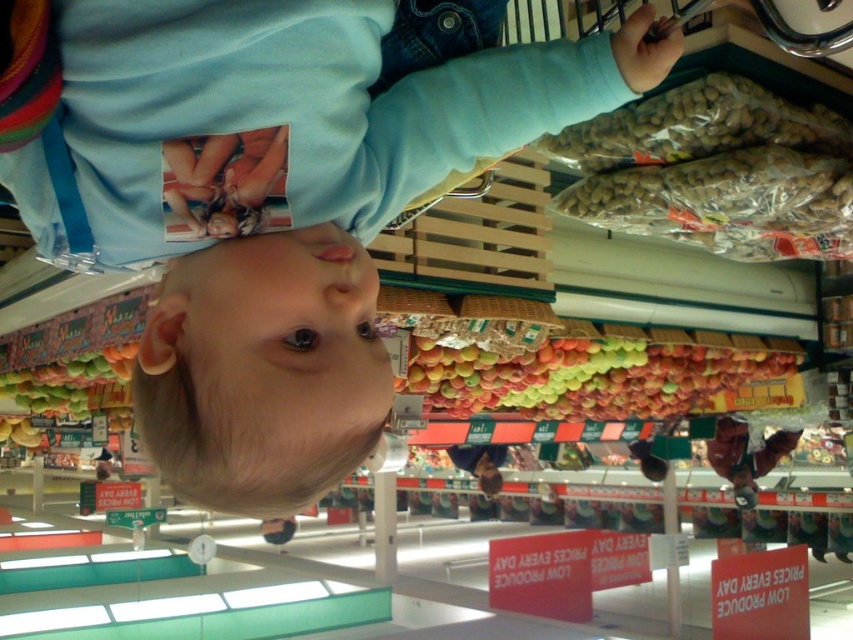
Between blue cotton sweatshirt at upper center and shiny red apples at center, which one has more height?

Answer: With more height is shiny red apples at center.

Is the position of blue cotton sweatshirt at upper center more distant than that of shiny red apples at center?

No, blue cotton sweatshirt at upper center is closer to the viewer.

Measure the distance between blue cotton sweatshirt at upper center and camera.

blue cotton sweatshirt at upper center and camera are 59.23 centimeters apart.

Locate an element on the screen. blue cotton sweatshirt at upper center is located at coordinates (283, 113).